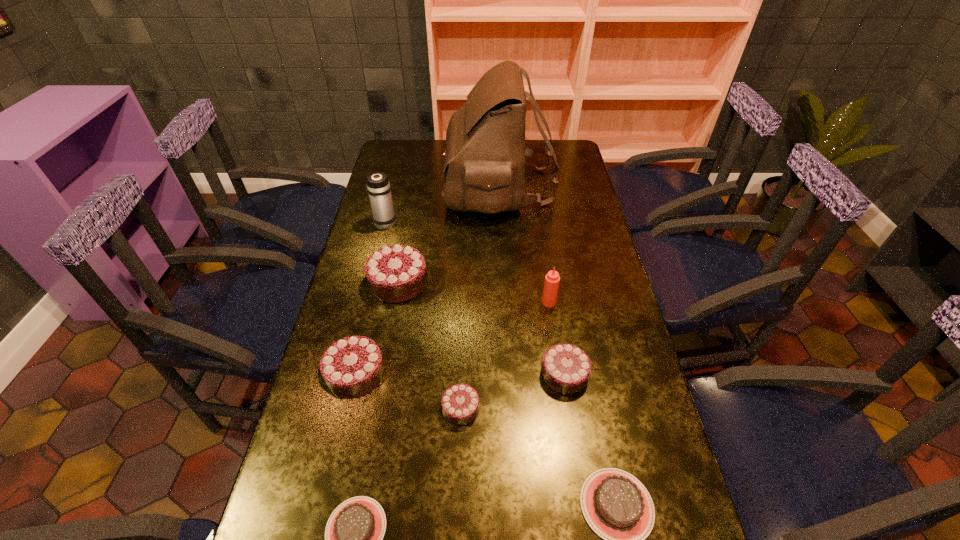
The height and width of the screenshot is (540, 960). I want to click on free space located on the front of the third smallest chocolate chocolate cake, so click(x=342, y=436).

You are a GUI agent. You are given a task and a screenshot of the screen. Output one action in this format:
    pyautogui.click(x=<x>, y=<y>)
    Task: Click on the vacant space located on the left of the fourth shortest chocolate cake
    
    Given the screenshot: What is the action you would take?
    pyautogui.click(x=393, y=374)

I want to click on vacant space located on the right of the second chocolate chocolate cake from right to left, so click(x=608, y=408).

You are a GUI agent. You are given a task and a screenshot of the screen. Output one action in this format:
    pyautogui.click(x=<x>, y=<y>)
    Task: Click on the object present at the far edge
    The width and height of the screenshot is (960, 540).
    Given the screenshot: What is the action you would take?
    pyautogui.click(x=487, y=539)

Locate an element on the screen. Image resolution: width=960 pixels, height=540 pixels. thermos bottle situated at the left edge is located at coordinates click(x=487, y=539).

Find the location of a particular element. The height and width of the screenshot is (540, 960). satchel present at the right edge is located at coordinates (487, 539).

Where is `chocolate cake that is at the right edge`? chocolate cake that is at the right edge is located at coordinates (487, 539).

Where is `object present at the far right corner`? object present at the far right corner is located at coordinates (487, 539).

You are a GUI agent. You are given a task and a screenshot of the screen. Output one action in this format:
    pyautogui.click(x=<x>, y=<y>)
    Task: Click on the free region at the left edge of the desktop
    
    Given the screenshot: What is the action you would take?
    pyautogui.click(x=374, y=221)

The height and width of the screenshot is (540, 960). What are the coordinates of `the sixth closest object to the second shortest chocolate cake` in the screenshot? It's located at (487, 539).